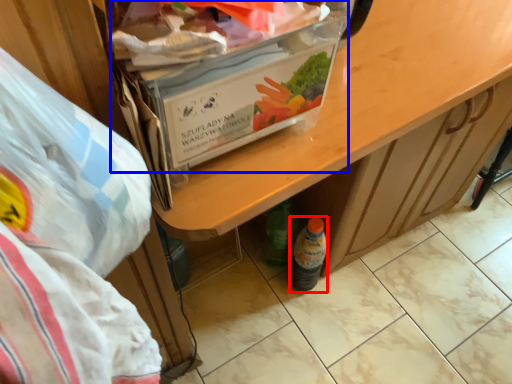
Question: Which object is further to the camera taking this photo, bottle (highlighted by a red box) or box (highlighted by a blue box)?

Choices:
 (A) bottle
 (B) box

Answer: (A)